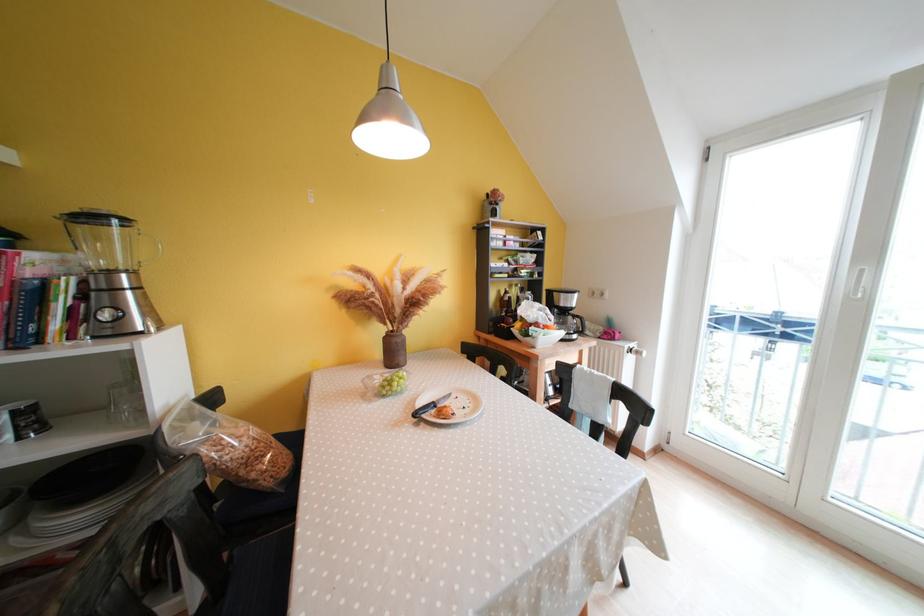
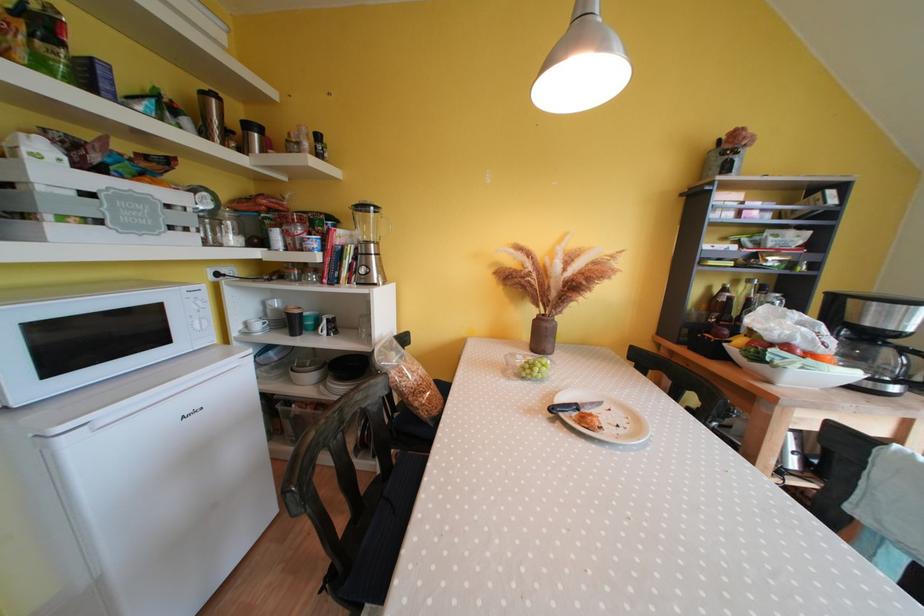
Find the pixel in the second image that matches the point at 199,411 in the first image.

(397, 345)